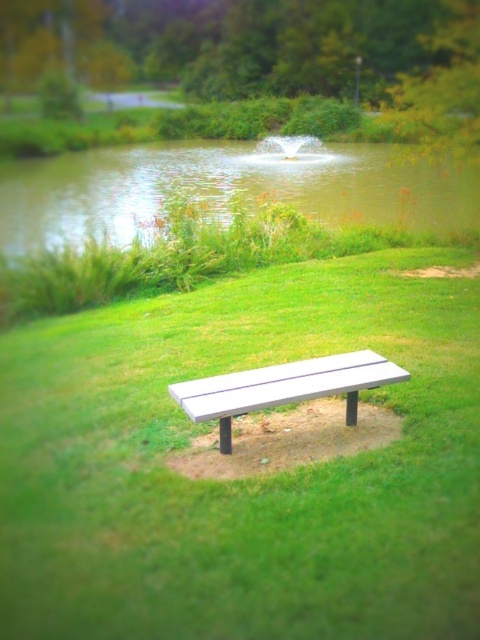
Can you confirm if white wood bench at center is wider than green leafy tree at center?

No.

Is point (37, 509) closer to viewer compared to point (433, 1)?

That is True.

Between point (12, 426) and point (242, 88), which one is positioned behind?

The point (242, 88) is more distant.

You are a GUI agent. You are given a task and a screenshot of the screen. Output one action in this format:
    pyautogui.click(x=<x>, y=<y>)
    Task: Click on the white wood bench at center
    
    Given the screenshot: What is the action you would take?
    pyautogui.click(x=242, y=480)

Does green grass at lower center have a greater height compared to white plastic bench at center?

Correct, green grass at lower center is much taller as white plastic bench at center.

Who is more distant from viewer, (67, 184) or (196, 419)?

Point (67, 184)

Locate an element on the screen. green grass at lower center is located at coordinates (230, 188).

Is white wood bench at center to the left of white plastic bench at center from the viewer's perspective?

No, white wood bench at center is not to the left of white plastic bench at center.

The height and width of the screenshot is (640, 480). Find the location of `white wood bench at center`. white wood bench at center is located at coordinates (242, 480).

I want to click on white wood bench at center, so click(x=242, y=480).